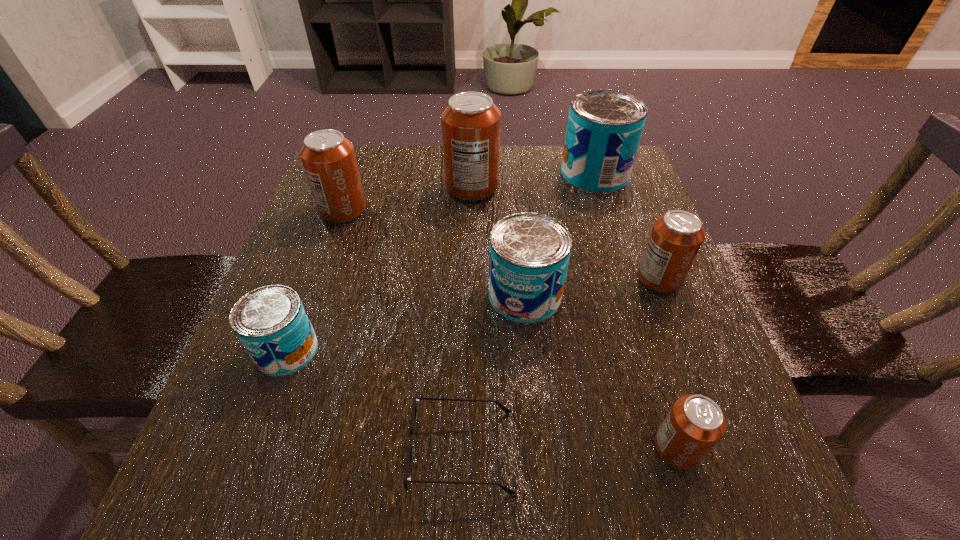
At what (x,y) coordinates should I click in order to perform the action: click on the smallest blue can. Please return your answer as a coordinate pair (x, y). Looking at the image, I should click on (271, 322).

Locate an element on the screen. the leftmost blue can is located at coordinates (271, 322).

Find the location of a particular element. The width and height of the screenshot is (960, 540). the shortest object is located at coordinates (407, 478).

In order to click on free space located on the back of the tallest can in this screenshot , I will do `click(472, 152)`.

Identify the location of free space located on the left of the farthest blue can. (477, 174).

Where is `blank area located 0.100m on the back of the leftmost orange can`? blank area located 0.100m on the back of the leftmost orange can is located at coordinates (356, 173).

The image size is (960, 540). Find the location of `vacant position located on the front of the second smallest blue can`. vacant position located on the front of the second smallest blue can is located at coordinates (544, 500).

Locate an element on the screen. This screenshot has width=960, height=540. vacant area situated on the back of the third biggest orange can is located at coordinates (614, 164).

You are a GUI agent. You are given a task and a screenshot of the screen. Output one action in this format:
    pyautogui.click(x=<x>, y=<y>)
    Task: Click on the free space located 0.050m on the right of the nearest can
    This screenshot has width=960, height=540.
    Given the screenshot: What is the action you would take?
    pyautogui.click(x=734, y=448)

This screenshot has width=960, height=540. In order to click on vacant space situated on the right of the third nearest object in this screenshot , I will do `click(400, 350)`.